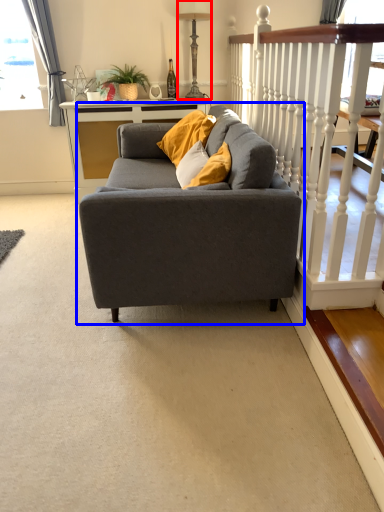
Question: Which object is closer to the camera taking this photo, lamp (highlighted by a red box) or studio couch (highlighted by a blue box)?

Choices:
 (A) lamp
 (B) studio couch

Answer: (B)